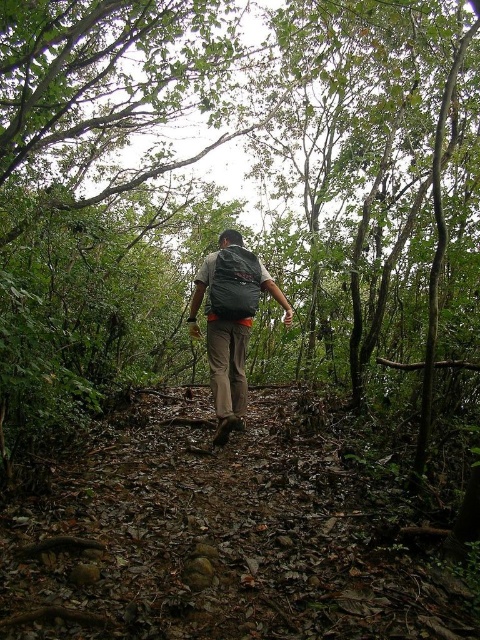
Question: Can you confirm if matte black backpack at center is bigger than dark gray fabric backpack at center?

Choices:
 (A) no
 (B) yes

Answer: (B)

Question: Which point is closer to the camera?

Choices:
 (A) matte black backpack at center
 (B) dark gray fabric backpack at center

Answer: (A)

Question: Can you confirm if matte black backpack at center is positioned above dark gray fabric backpack at center?

Choices:
 (A) yes
 (B) no

Answer: (B)

Question: Is matte black backpack at center to the left of dark gray fabric backpack at center from the viewer's perspective?

Choices:
 (A) yes
 (B) no

Answer: (B)

Question: Which object is closer to the camera taking this photo?

Choices:
 (A) dark gray fabric backpack at center
 (B) matte black backpack at center

Answer: (B)

Question: Which point is closer to the camera?

Choices:
 (A) matte black backpack at center
 (B) dark gray fabric backpack at center

Answer: (A)